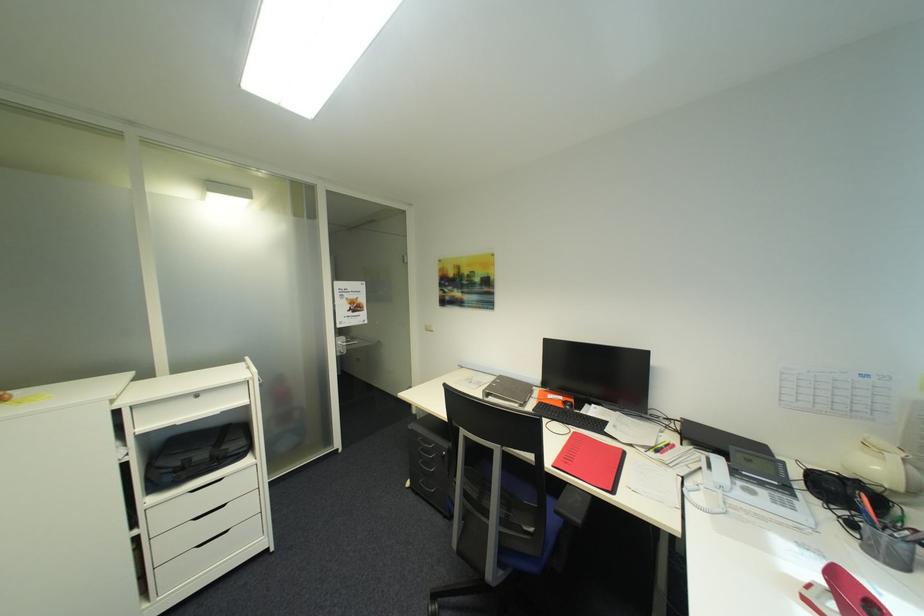
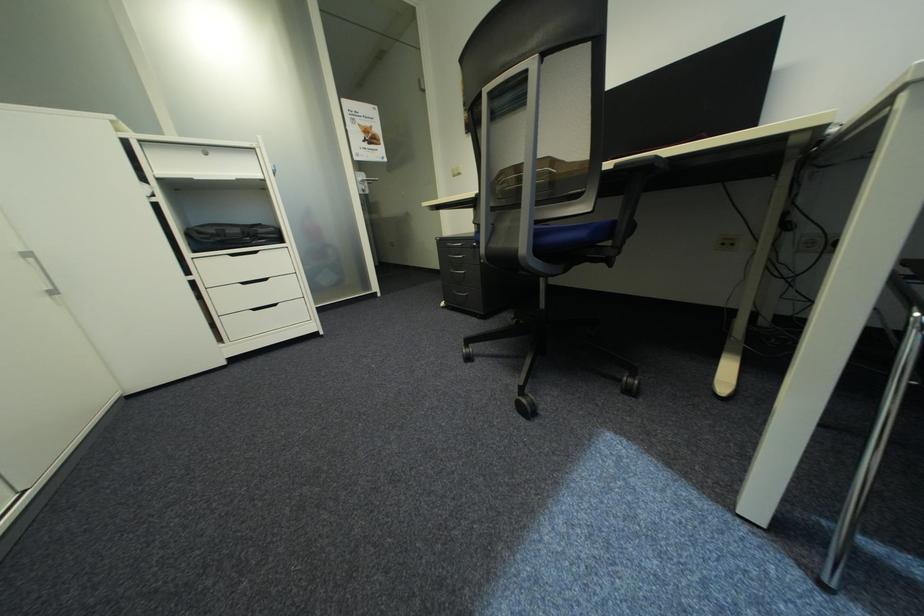
In the second image, find the point that corresponds to (x=142, y=533) in the first image.

(199, 278)